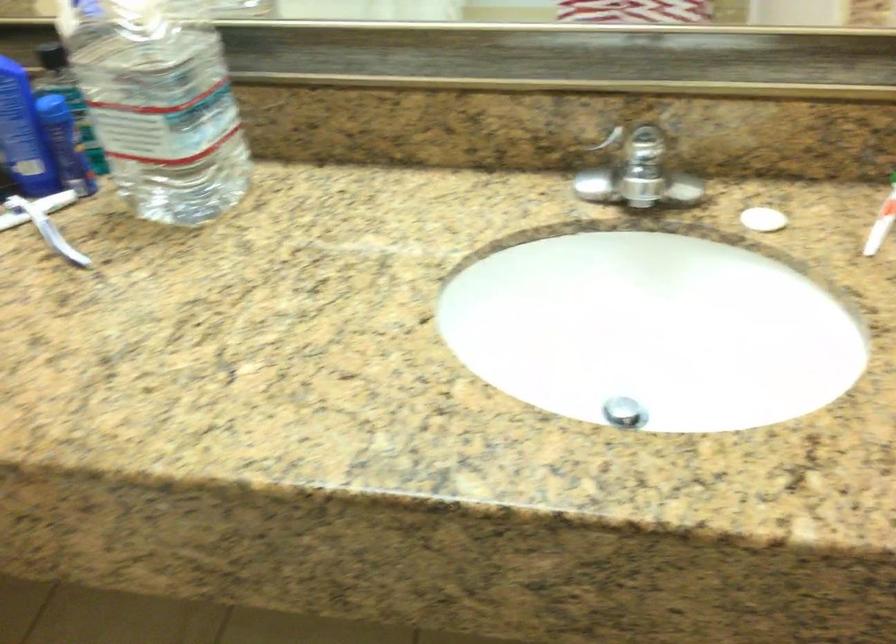
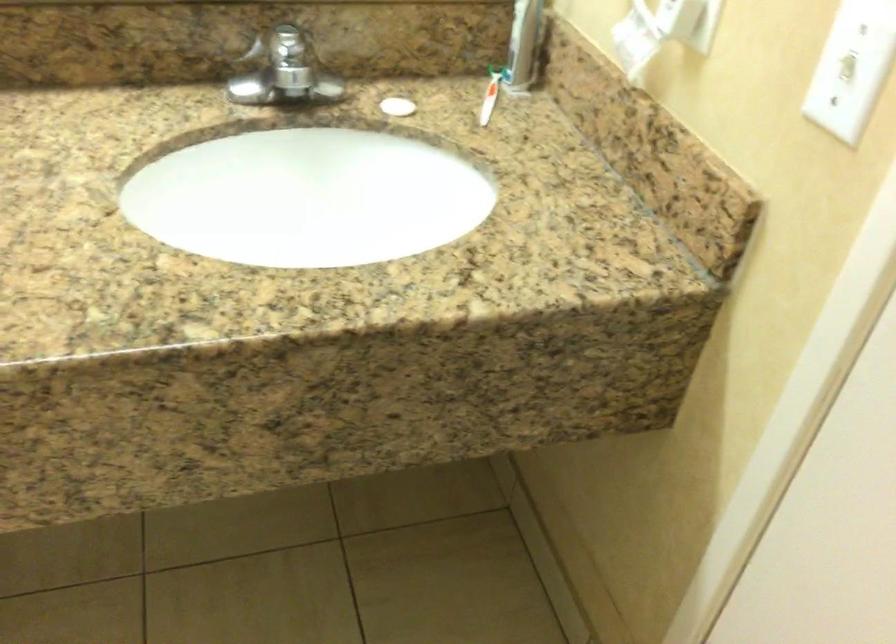
Where in the second image is the point corresponding to pixel 760 216 from the first image?

(398, 106)